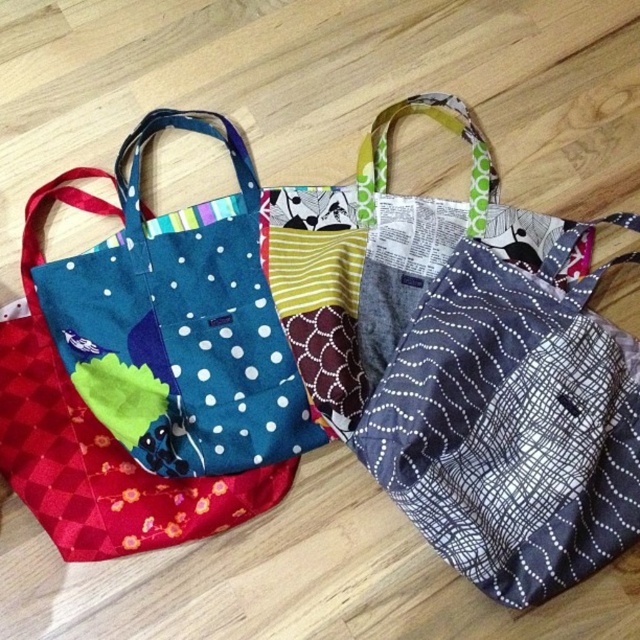
Who is more distant from viewer, (230, 500) or (490, 316)?

The point (490, 316) is behind.

Which is below, blue fabric tote at left or gray dotted fabric pocket at center?

Positioned lower is gray dotted fabric pocket at center.

The image size is (640, 640). I want to click on blue fabric tote at left, so coord(148,371).

The height and width of the screenshot is (640, 640). Find the location of `blue fabric tote at left`. blue fabric tote at left is located at coordinates (148, 371).